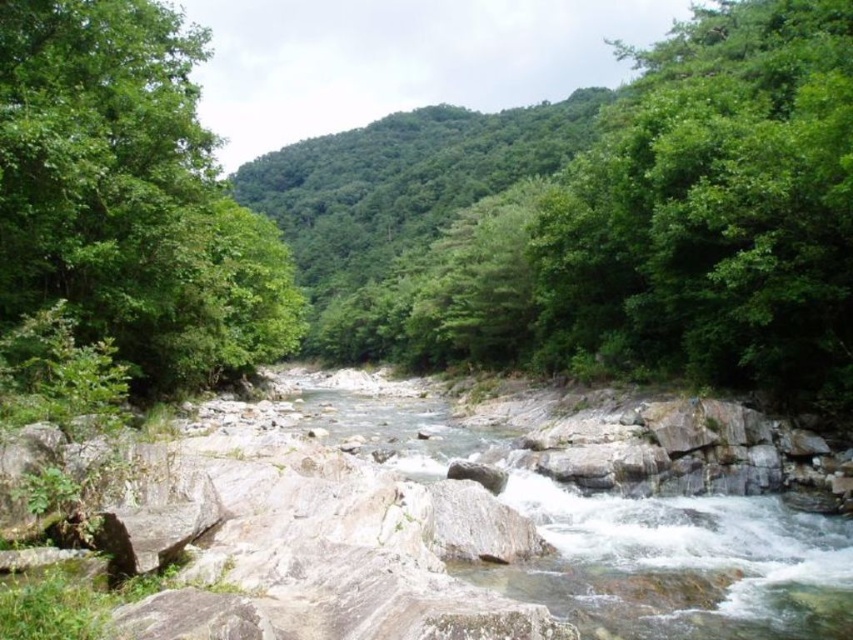
You are standing at the edge of the river and want to take a photo of the green leafy tree at upper right and the clear water at center. Which object should you frame first in your camera viewfinder to ensure both are in the shot?

You should frame the clear water at center first because the green leafy tree at upper right is to the right of it, so positioning the water centrally allows the tree to be included on its right side within the frame.

You are a hiker standing on the trail overlooking the river. You notice the green leafy tree at left and the clear water at center. Which object is positioned higher in elevation?

The green leafy tree at left is located above clear water at center, so it is positioned higher in elevation.

You are a hiker who wants to cross the river using a 10 meter long rope bridge. You see the green leafy tree at left and the clear water at center. Can you safely cross the river using the bridge without the bridge collapsing?

The green leafy tree at left and clear water at center are 11.77 meters apart from each other. The rope bridge is only 10 meters long, so it would be too short to span the distance between them. Therefore, the bridge would collapse if used to cross between these two points.